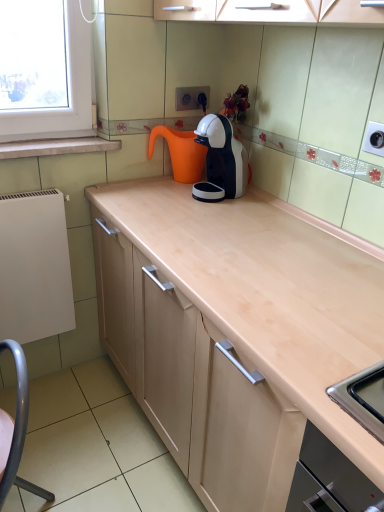
Question: Does white marble window sill at upper left have a smaller size compared to orange matte water jug at center?

Choices:
 (A) no
 (B) yes

Answer: (B)

Question: Is white marble window sill at upper left facing away from orange matte water jug at center?

Choices:
 (A) yes
 (B) no

Answer: (B)

Question: From a real-world perspective, is white marble window sill at upper left on orange matte water jug at center?

Choices:
 (A) yes
 (B) no

Answer: (A)

Question: Can you confirm if white marble window sill at upper left is wider than orange matte water jug at center?

Choices:
 (A) yes
 (B) no

Answer: (B)

Question: Does white marble window sill at upper left turn towards orange matte water jug at center?

Choices:
 (A) yes
 (B) no

Answer: (B)

Question: From a real-world perspective, is white marble window sill at upper left below orange matte water jug at center?

Choices:
 (A) yes
 (B) no

Answer: (B)

Question: Is white marble window sill at upper left facing away from metallic gray swivel chair at lower left?

Choices:
 (A) yes
 (B) no

Answer: (B)

Question: From the image's perspective, would you say white marble window sill at upper left is positioned over metallic gray swivel chair at lower left?

Choices:
 (A) yes
 (B) no

Answer: (A)

Question: Considering the relative positions of white marble window sill at upper left and metallic gray swivel chair at lower left in the image provided, is white marble window sill at upper left to the right of metallic gray swivel chair at lower left from the viewer's perspective?

Choices:
 (A) no
 (B) yes

Answer: (A)

Question: Is white marble window sill at upper left completely or partially outside of metallic gray swivel chair at lower left?

Choices:
 (A) no
 (B) yes

Answer: (B)

Question: Is white marble window sill at upper left oriented towards metallic gray swivel chair at lower left?

Choices:
 (A) yes
 (B) no

Answer: (B)

Question: Considering the relative sizes of white marble window sill at upper left and metallic gray swivel chair at lower left in the image provided, is white marble window sill at upper left thinner than metallic gray swivel chair at lower left?

Choices:
 (A) no
 (B) yes

Answer: (B)

Question: From a real-world perspective, does white marble window sill at upper left stand above white matte radiator at left?

Choices:
 (A) no
 (B) yes

Answer: (B)